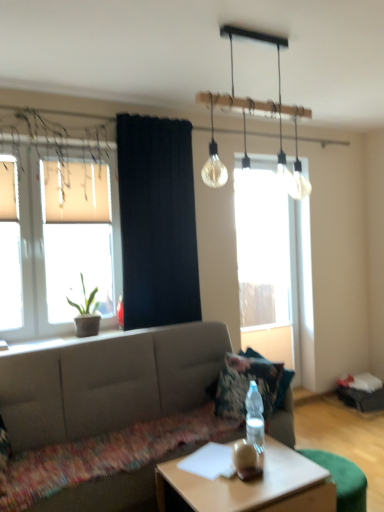
Question: Does green matte plant at left have a lesser width compared to translucent glass light fixture at upper center?

Choices:
 (A) yes
 (B) no

Answer: (A)

Question: Is green matte plant at left outside of translucent glass light fixture at upper center?

Choices:
 (A) yes
 (B) no

Answer: (A)

Question: Is green matte plant at left positioned with its back to translucent glass light fixture at upper center?

Choices:
 (A) yes
 (B) no

Answer: (B)

Question: Is green matte plant at left bigger than translucent glass light fixture at upper center?

Choices:
 (A) no
 (B) yes

Answer: (A)

Question: From the image's perspective, is green matte plant at left under translucent glass light fixture at upper center?

Choices:
 (A) no
 (B) yes

Answer: (B)

Question: Is point (253, 400) closer or farther from the camera than point (125, 333)?

Choices:
 (A) farther
 (B) closer

Answer: (B)

Question: In the image, is clear plastic bottle at center on the left side or the right side of matte gray couch at center?

Choices:
 (A) right
 (B) left

Answer: (A)

Question: From the image's perspective, is clear plastic bottle at center located above or below matte gray couch at center?

Choices:
 (A) below
 (B) above

Answer: (B)

Question: In terms of height, does clear plastic bottle at center look taller or shorter compared to matte gray couch at center?

Choices:
 (A) tall
 (B) short

Answer: (B)

Question: From the image's perspective, is matte gray couch at center located above or below green matte plant at left?

Choices:
 (A) below
 (B) above

Answer: (A)

Question: Looking at the image, does matte gray couch at center seem bigger or smaller compared to green matte plant at left?

Choices:
 (A) small
 (B) big

Answer: (B)

Question: Is matte gray couch at center in front of or behind green matte plant at left in the image?

Choices:
 (A) behind
 (B) front

Answer: (B)

Question: Considering the positions of matte gray couch at center and green matte plant at left in the image, is matte gray couch at center taller or shorter than green matte plant at left?

Choices:
 (A) tall
 (B) short

Answer: (A)

Question: Would you say translucent glass light fixture at upper center is to the left or to the right of translucent glass window at left, which ranks as the second window in back-to-front order, in the picture?

Choices:
 (A) left
 (B) right

Answer: (B)

Question: From a real-world perspective, relative to translucent glass window at left, the 1th window when ordered from front to back, is translucent glass light fixture at upper center vertically above or below?

Choices:
 (A) above
 (B) below

Answer: (A)